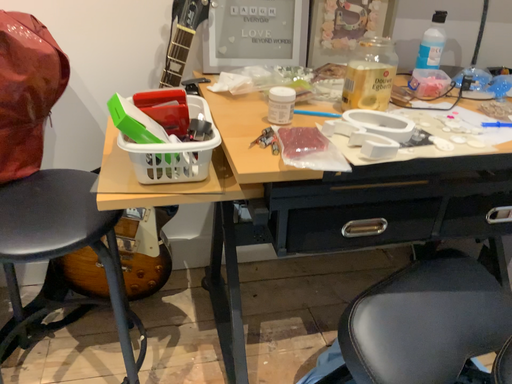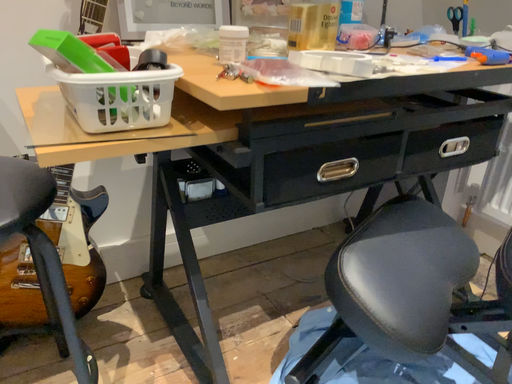
Question: How did the camera likely rotate when shooting the video?

Choices:
 (A) rotated right
 (B) rotated left

Answer: (A)